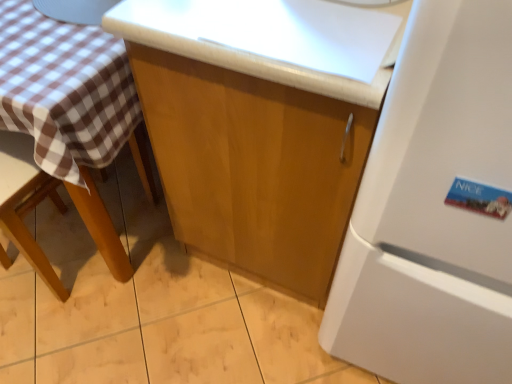
Locate an element on the screen. The image size is (512, 384). vacant space situated above glossy wood cabinet at center (from a real-world perspective) is located at coordinates (288, 19).